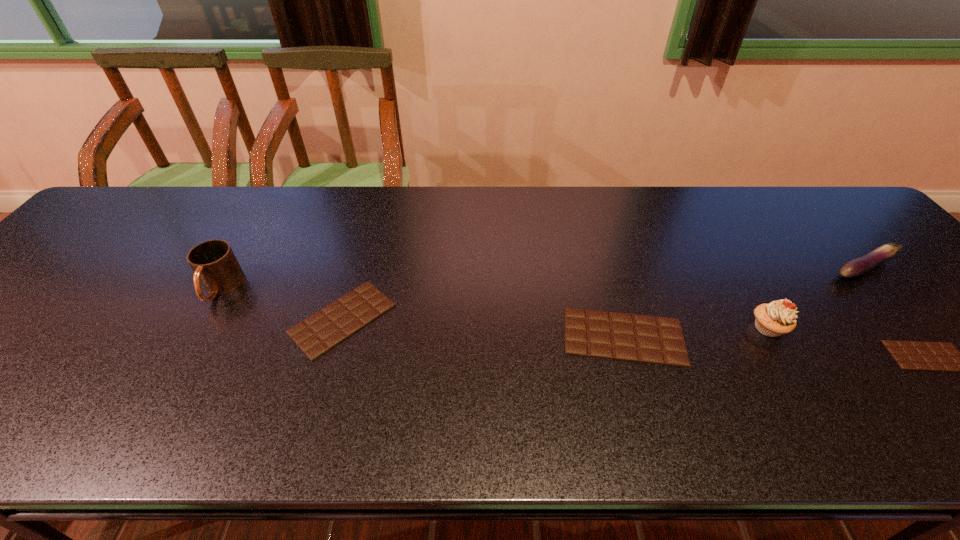
Given the evenly spaced chocolate bars in the image, where should an extra chocolate bar be added on the left to preserve the spacing? Please point to a vacant space. Please provide its 2D coordinates. Your answer should be formatted as a tuple, i.e. [(x, y)], where the tuple contains the x and y coordinates of a point satisfying the conditions above.

[(81, 302)]